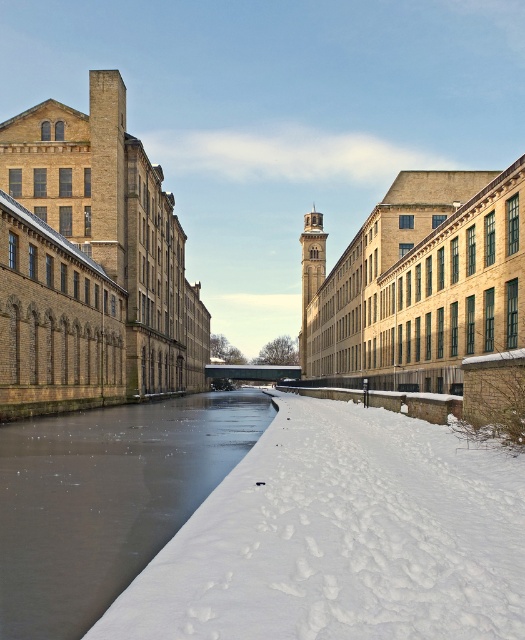
Question: Is the position of white fluffy snow at lower right less distant than that of frozen ice at center?

Choices:
 (A) no
 (B) yes

Answer: (B)

Question: Which point appears farthest from the camera in this image?

Choices:
 (A) (16, 436)
 (B) (467, 566)

Answer: (A)

Question: Is white fluffy snow at lower right to the left of frozen ice at center from the viewer's perspective?

Choices:
 (A) yes
 (B) no

Answer: (B)

Question: Is white fluffy snow at lower right to the right of frozen ice at center from the viewer's perspective?

Choices:
 (A) no
 (B) yes

Answer: (B)